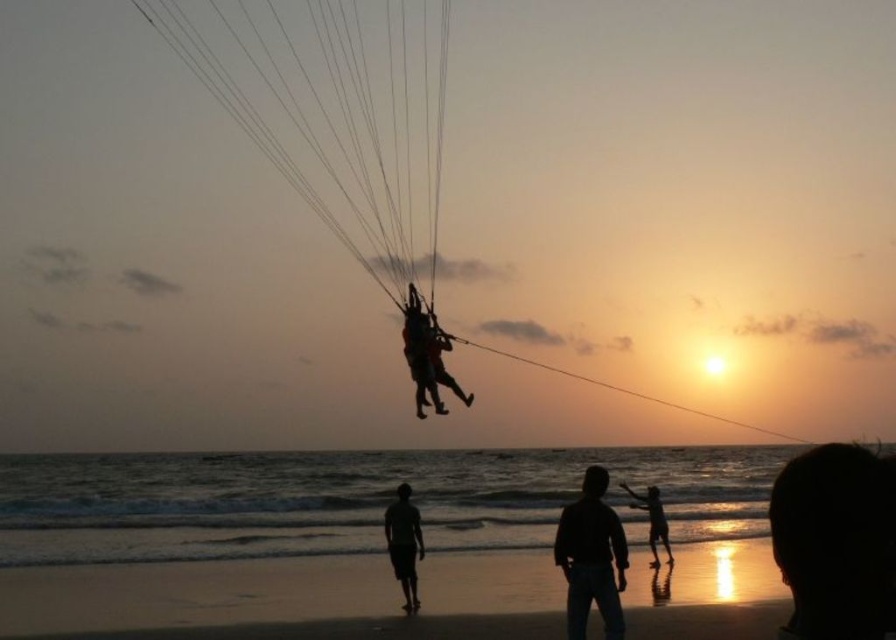
Does silhouette jeans at lower center appear on the right side of silhouette sand at lower right?

In fact, silhouette jeans at lower center is to the left of silhouette sand at lower right.

Between point (617, 582) and point (653, 563), which one is positioned in front?

Point (617, 582) is more forward.

In order to click on silhouette jeans at lower center in this screenshot , I will do `click(591, 557)`.

Which is more to the right, sandy beach at lower center or silhouette jeans at lower center?

From the viewer's perspective, silhouette jeans at lower center appears more on the right side.

Does point (530, 577) lie behind point (582, 524)?

Yes, point (530, 577) is farther from viewer.

Between point (33, 604) and point (593, 508), which one is positioned behind?

The point (33, 604) is behind.

What are the coordinates of `sandy beach at lower center` in the screenshot? It's located at (274, 593).

Is silhouette jeans at lower center further to camera compared to silhouette sand at lower center?

No, it is in front of silhouette sand at lower center.

Can you confirm if silhouette jeans at lower center is wider than silhouette sand at lower center?

Yes, silhouette jeans at lower center is wider than silhouette sand at lower center.

Who is more forward, (573, 525) or (386, 506)?

Point (573, 525) is more forward.

Where is `silhouette jeans at lower center`? The width and height of the screenshot is (896, 640). silhouette jeans at lower center is located at coordinates (591, 557).